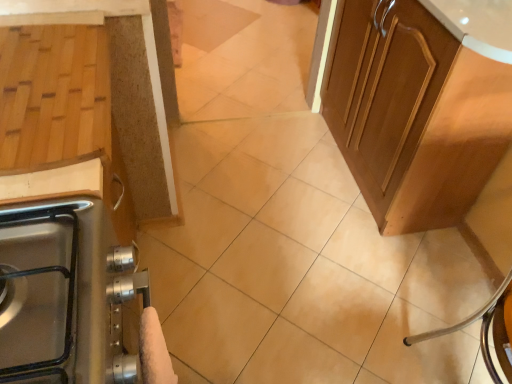
The height and width of the screenshot is (384, 512). What are the coordinates of `free region on the left part of glossy wood cabinet at upper right, which is counted as the first cabinetry, starting from the right` in the screenshot? It's located at (268, 179).